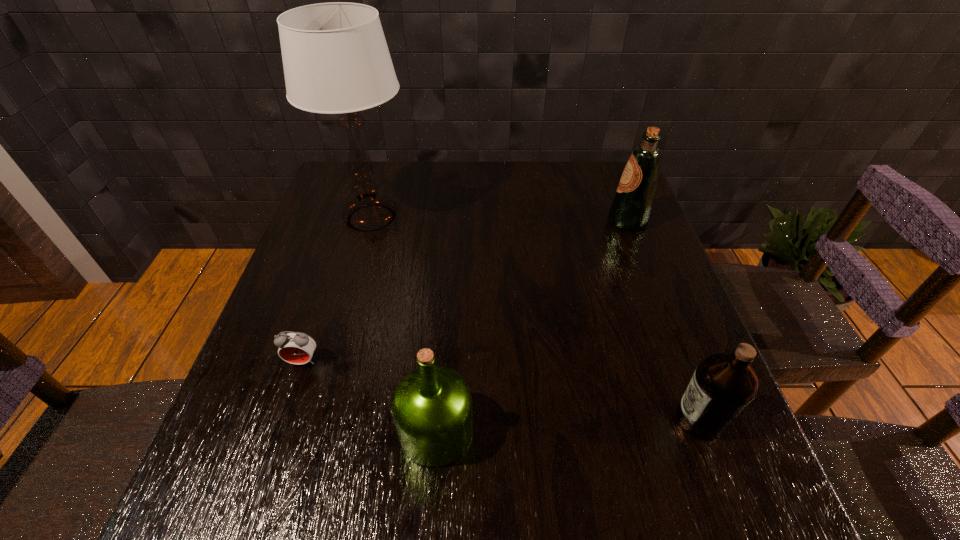
Identify the location of vacant region that satisfies the following two spatial constraints: 1. on the front-facing side of the tallest object; 2. on the back side of the leftmost olive oil. This screenshot has width=960, height=540. (310, 431).

Image resolution: width=960 pixels, height=540 pixels. In order to click on vacant space that satisfies the following two spatial constraints: 1. on the front-facing side of the table lamp; 2. on the face of the third farthest object in this screenshot , I will do `click(330, 361)`.

Identify the location of free space that satisfies the following two spatial constraints: 1. on the front-facing side of the tallest object; 2. on the right side of the third object from left to right. (310, 431).

Locate an element on the screen. This screenshot has width=960, height=540. vacant position in the image that satisfies the following two spatial constraints: 1. on the front-facing side of the tallest object; 2. on the face of the third farthest object is located at coordinates (330, 361).

At what (x,y) coordinates should I click in order to perform the action: click on free spot that satisfies the following two spatial constraints: 1. on the front-facing side of the farthest olive oil; 2. on the face of the alarm clock. Please return your answer as a coordinate pair (x, y). Looking at the image, I should click on (681, 361).